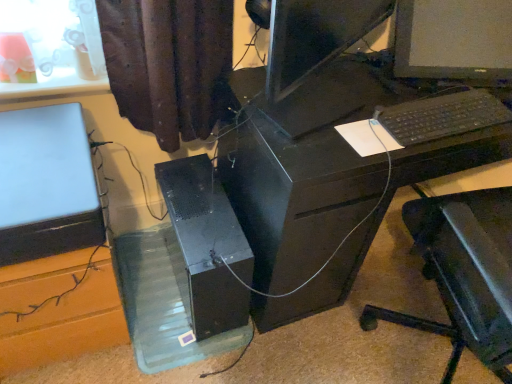
What is the approximate width of black plastic desk at center?

It is 22.42 inches.

The height and width of the screenshot is (384, 512). Describe the element at coordinates (442, 116) in the screenshot. I see `black plastic keyboard at right` at that location.

Identify the location of matte black monitor at center. (454, 39).

Considering the sizes of objects matte black monitor at center and satin black laptop at left in the image provided, who is bigger, matte black monitor at center or satin black laptop at left?

Bigger between the two is matte black monitor at center.

Is satin black laptop at left inside matte black monitor at center?

No, satin black laptop at left is located outside of matte black monitor at center.

From the image's perspective, between matte black monitor at center and satin black laptop at left, who is located below?

satin black laptop at left.

In the scene shown: From a real-world perspective, which is physically above, matte black monitor at center or satin black laptop at left?

matte black monitor at center is physically above.

From the image's perspective, between black plastic keyboard at right and transparent plastic glass box at lower center, which one is located above?

black plastic keyboard at right.

In the image, is black plastic keyboard at right positioned in front of or behind transparent plastic glass box at lower center?

black plastic keyboard at right is positioned closer to the viewer than transparent plastic glass box at lower center.

Image resolution: width=512 pixels, height=384 pixels. I want to click on glass box on the left of black plastic keyboard at right, so click(x=160, y=307).

How far apart are black plastic keyboard at right and transparent plastic glass box at lower center?

A distance of 38.14 inches exists between black plastic keyboard at right and transparent plastic glass box at lower center.

Is transparent plastic glass box at lower center at the right side of black plastic desk at center?

Incorrect, transparent plastic glass box at lower center is not on the right side of black plastic desk at center.

Does transparent plastic glass box at lower center lie in front of black plastic desk at center?

No, transparent plastic glass box at lower center is further to the viewer.

Who is taller, black plastic desk at center or black plastic keyboard at right?

black plastic desk at center is taller.

How far apart are black plastic desk at center and black plastic keyboard at right?

A distance of 10.23 inches exists between black plastic desk at center and black plastic keyboard at right.

Can you confirm if black plastic desk at center is positioned to the right of black plastic keyboard at right?

No, black plastic desk at center is not to the right of black plastic keyboard at right.

How far apart are black plastic desk at center and matte black monitor at center?

A: A distance of 15.55 inches exists between black plastic desk at center and matte black monitor at center.

In order to click on computer monitor above the black plastic desk at center (from the image's perspective) in this screenshot , I will do `click(454, 39)`.

Is black plastic desk at center smaller than matte black monitor at center?

No.

Which object is positioned more to the left, black plastic desk at center or matte black monitor at center?

From the viewer's perspective, black plastic desk at center appears more on the left side.

Is black plastic keyboard at right oriented away from black matte computer tower at center?

No, black plastic keyboard at right is not facing the opposite direction of black matte computer tower at center.

Are black plastic keyboard at right and black matte computer tower at center beside each other?

No, black plastic keyboard at right is not touching black matte computer tower at center.

Can you tell me how much black plastic keyboard at right and black matte computer tower at center differ in facing direction?

black plastic keyboard at right and black matte computer tower at center are facing 2.77 degrees away from each other.

In the image, there is a black matte computer tower at center. Identify the location of computer keyboard above it (from the image's perspective). Image resolution: width=512 pixels, height=384 pixels. (442, 116).

Considering the relative sizes of transparent plastic glass box at lower center and black plastic keyboard at right in the image provided, is transparent plastic glass box at lower center taller than black plastic keyboard at right?

Yes.

You are a GUI agent. You are given a task and a screenshot of the screen. Output one action in this format:
    pyautogui.click(x=<x>, y=<y>)
    Task: Click on the computer keyboard on the right of transparent plastic glass box at lower center
    The image size is (512, 384).
    Given the screenshot: What is the action you would take?
    pyautogui.click(x=442, y=116)

Is transparent plastic glass box at lower center not close to black plastic keyboard at right?

transparent plastic glass box at lower center is near black plastic keyboard at right, not far away.

Do you think transparent plastic glass box at lower center is within black plastic keyboard at right, or outside of it?

transparent plastic glass box at lower center is spatially situated outside black plastic keyboard at right.

Image resolution: width=512 pixels, height=384 pixels. In order to click on computer below the matte black monitor at center (from a real-world perspective) in this screenshot , I will do `click(46, 184)`.

At what (x,y) coordinates should I click in order to perform the action: click on computer keyboard lying in front of the transparent plastic glass box at lower center. Please return your answer as a coordinate pair (x, y). This screenshot has height=384, width=512. Looking at the image, I should click on (442, 116).

In the scene shown: Estimate the real-world distances between objects in this image. Which object is further from black plastic desk at center, transparent plastic glass box at lower center or black plastic keyboard at right?

transparent plastic glass box at lower center is positioned further to the anchor black plastic desk at center.

Which object lies nearer to the anchor point black plastic keyboard at right, matte black monitor at center or transparent plastic glass box at lower center?

The object closer to black plastic keyboard at right is matte black monitor at center.

From the image, which object appears to be nearer to satin black laptop at left, black matte computer tower at center or black plastic desk at center?

black matte computer tower at center.

Considering their positions, is black plastic keyboard at right positioned further to black matte computer tower at center than satin black laptop at left?

Based on the image, black plastic keyboard at right appears to be further to black matte computer tower at center.

Looking at the image, which one is located closer to black plastic desk at center, matte black monitor at center or transparent plastic glass box at lower center?

matte black monitor at center is positioned closer to the anchor black plastic desk at center.

Estimate the real-world distances between objects in this image. Which object is further from black plastic desk at center, black matte computer tower at center or satin black laptop at left?

The object further to black plastic desk at center is satin black laptop at left.

Based on their spatial positions, is black plastic keyboard at right or transparent plastic glass box at lower center further from black matte computer tower at center?

black plastic keyboard at right is further to black matte computer tower at center.

Estimate the real-world distances between objects in this image. Which object is further from black plastic keyboard at right, black plastic desk at center or transparent plastic glass box at lower center?

The object further to black plastic keyboard at right is transparent plastic glass box at lower center.

Identify the location of desk located between transparent plastic glass box at lower center and black plastic keyboard at right in the left-right direction. The height and width of the screenshot is (384, 512). (301, 167).

Identify the location of computer keyboard between satin black laptop at left and matte black monitor at center in the horizontal direction. The image size is (512, 384). (442, 116).

The width and height of the screenshot is (512, 384). I want to click on desk between satin black laptop at left and matte black monitor at center from left to right, so click(x=301, y=167).

Locate an element on the screen. Image resolution: width=512 pixels, height=384 pixels. computer keyboard between matte black monitor at center and black plastic desk at center in the up-down direction is located at coordinates (442, 116).